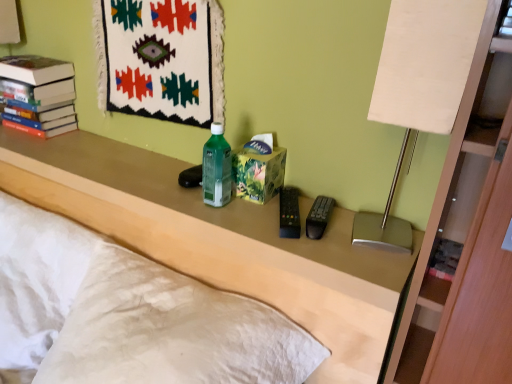
Question: Is matte plastic remote control at center completely or partially inside matte beige table lamp at right?

Choices:
 (A) no
 (B) yes

Answer: (A)

Question: Could you tell me if matte beige table lamp at right is turned towards matte plastic remote control at center?

Choices:
 (A) yes
 (B) no

Answer: (B)

Question: From a real-world perspective, is matte beige table lamp at right physically above matte plastic remote control at center?

Choices:
 (A) yes
 (B) no

Answer: (A)

Question: Would you consider matte beige table lamp at right to be distant from matte plastic remote control at center?

Choices:
 (A) no
 (B) yes

Answer: (A)

Question: Considering the relative positions of matte beige table lamp at right and matte plastic remote control at center in the image provided, is matte beige table lamp at right in front of matte plastic remote control at center?

Choices:
 (A) yes
 (B) no

Answer: (A)

Question: In terms of width, does matte beige table lamp at right look wider or thinner when compared to hardcover books at upper left?

Choices:
 (A) wide
 (B) thin

Answer: (B)

Question: From the image's perspective, is matte beige table lamp at right positioned above or below hardcover books at upper left?

Choices:
 (A) below
 (B) above

Answer: (A)

Question: Does point (416, 41) appear closer or farther from the camera than point (38, 97)?

Choices:
 (A) closer
 (B) farther

Answer: (A)

Question: Is matte beige table lamp at right in front of or behind hardcover books at upper left in the image?

Choices:
 (A) behind
 (B) front

Answer: (B)

Question: In the image, is hardcover books at upper left positioned in front of or behind matte beige table lamp at right?

Choices:
 (A) front
 (B) behind

Answer: (B)

Question: Considering the relative positions of hardcover books at upper left and matte beige table lamp at right in the image provided, is hardcover books at upper left to the left or to the right of matte beige table lamp at right?

Choices:
 (A) right
 (B) left

Answer: (B)

Question: Considering the positions of hardcover books at upper left and matte beige table lamp at right in the image, is hardcover books at upper left bigger or smaller than matte beige table lamp at right?

Choices:
 (A) big
 (B) small

Answer: (A)

Question: Is hardcover books at upper left inside or outside of matte beige table lamp at right?

Choices:
 (A) inside
 (B) outside

Answer: (B)

Question: Considering the positions of matte plastic remote control at center and white textured pillow at lower left in the image, is matte plastic remote control at center bigger or smaller than white textured pillow at lower left?

Choices:
 (A) small
 (B) big

Answer: (B)

Question: From the image's perspective, is matte plastic remote control at center above or below white textured pillow at lower left?

Choices:
 (A) below
 (B) above

Answer: (B)